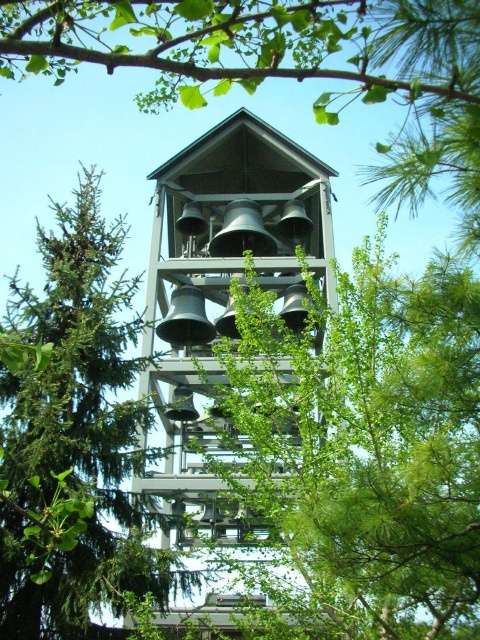
You are standing at the base of the bell tower and looking upwards. Which object, the green pine tree at center or the metallic gray bells at center, is positioned higher up in the scene?

The green pine tree at center is located above the metallic gray bells at center, so it is positioned higher up in the scene.

You are standing at the base of the bell tower and want to place a new decorative item between the green pine tree at center and the metallic gray bells at center. The decorative item requires a space of 12 meters between the two objects. Is there enough space for it?

The green pine tree at center is 13.35 meters away from metallic gray bells at center, so yes, there is enough space for the decorative item since the distance between them is greater than 12 meters.

You are standing at the base of the bell tower and notice a point marked at coordinates (73, 436). Based on the scene description, can you determine which object this point is located on?

The point at coordinates (73, 436) is located on the green pine tree at center.